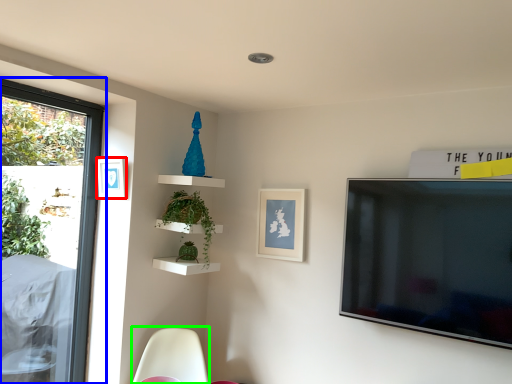
Question: Which is farther away from picture frame (highlighted by a red box)? window (highlighted by a blue box) or swivel chair (highlighted by a green box)?

Choices:
 (A) window
 (B) swivel chair

Answer: (B)